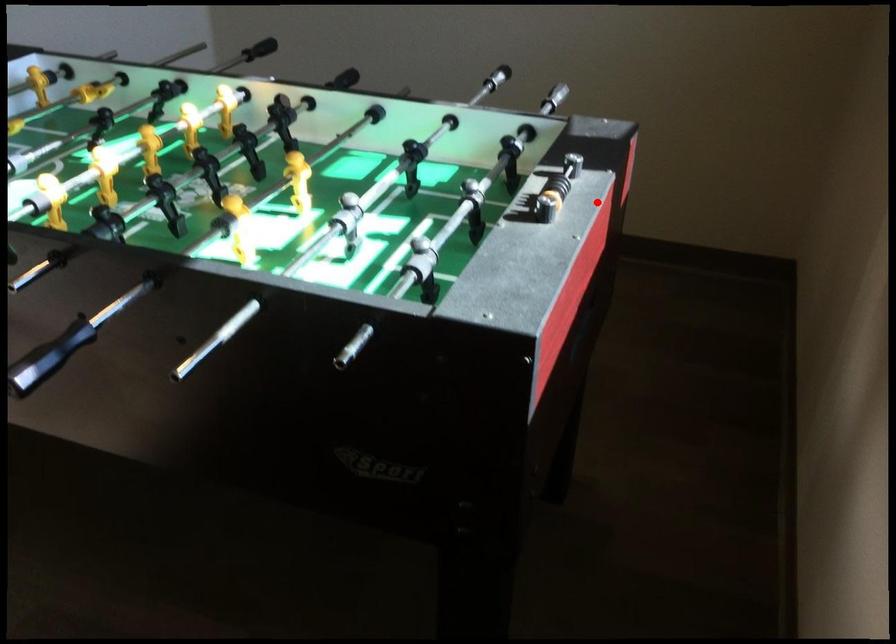
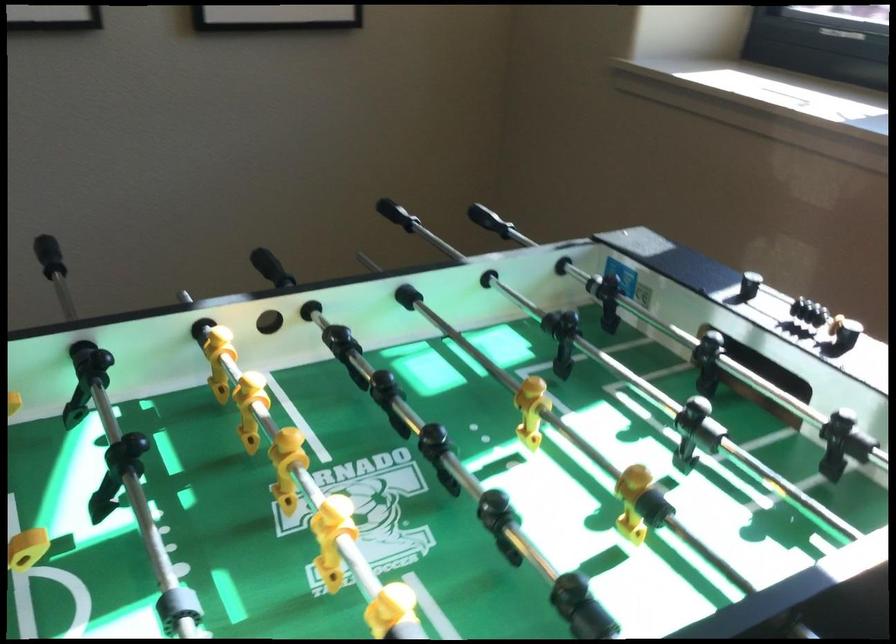
In the second image, find the point that corresponds to the highlighted location in the first image.

(819, 315)